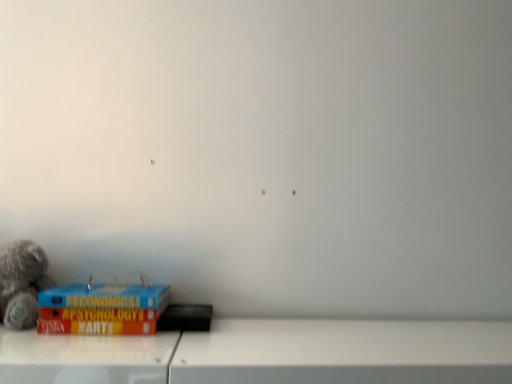
Question: In terms of height, does blue hardcover book at lower left look taller or shorter compared to fluffy gray teddy bear at left?

Choices:
 (A) short
 (B) tall

Answer: (A)

Question: Is point (130, 288) closer or farther from the camera than point (23, 294)?

Choices:
 (A) closer
 (B) farther

Answer: (A)

Question: Looking at their shapes, would you say blue hardcover book at lower left is wider or thinner than fluffy gray teddy bear at left?

Choices:
 (A) thin
 (B) wide

Answer: (B)

Question: Based on their sizes in the image, would you say fluffy gray teddy bear at left is bigger or smaller than blue hardcover book at lower left?

Choices:
 (A) big
 (B) small

Answer: (B)

Question: Is point (6, 276) positioned closer to the camera than point (132, 316)?

Choices:
 (A) closer
 (B) farther

Answer: (B)

Question: Based on their positions, is fluffy gray teddy bear at left located to the left or right of blue hardcover book at lower left?

Choices:
 (A) left
 (B) right

Answer: (A)

Question: Considering their positions, is fluffy gray teddy bear at left located in front of or behind blue hardcover book at lower left?

Choices:
 (A) front
 (B) behind

Answer: (B)